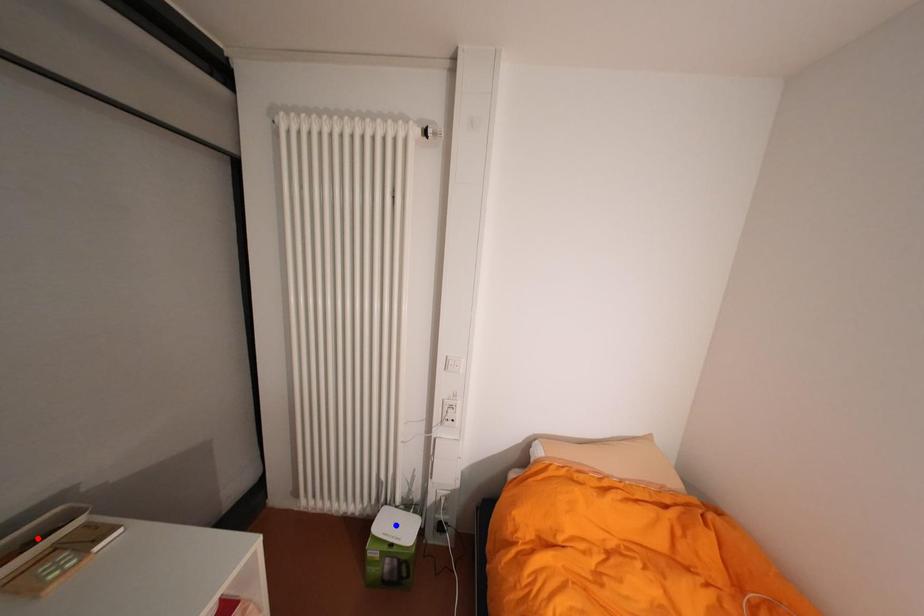
Question: Which of the two points in the image is closer to the camera?

Choices:
 (A) Blue point is closer.
 (B) Red point is closer.

Answer: (B)